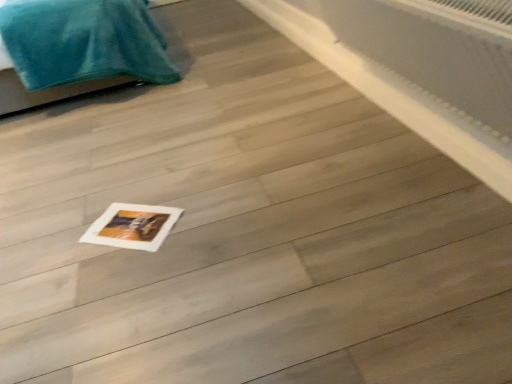
Identify the location of free space in front of white glossy magazine at center. The height and width of the screenshot is (384, 512). (121, 274).